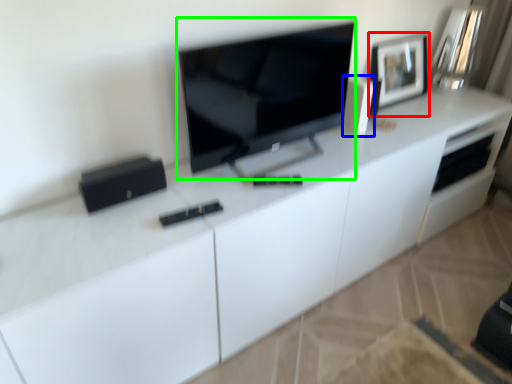
Question: Which object is positioned farthest from picture frame (highlighted by a red box)? Select from appliance (highlighted by a blue box) and television (highlighted by a green box).

Choices:
 (A) appliance
 (B) television

Answer: (B)